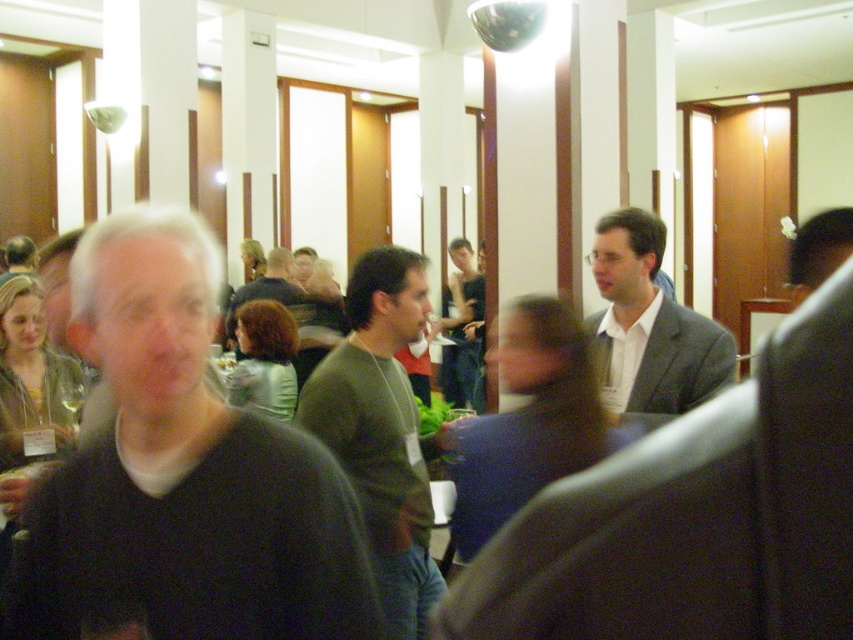
Question: Estimate the real-world distances between objects in this image. Which object is closer to the dark gray sweater at center?

Choices:
 (A) green matte sweater at center
 (B) white shirt at center
 (C) light gray suit at center
 (D) green matte shirt at center

Answer: (B)

Question: Does white shirt at center lie behind green matte shirt at center?

Choices:
 (A) no
 (B) yes

Answer: (A)

Question: In this image, where is dark gray sweater at center located relative to green matte shirt at center?

Choices:
 (A) above
 (B) below

Answer: (B)

Question: Can you confirm if dark gray sweater at center is positioned to the left of green matte sweater at center?

Choices:
 (A) yes
 (B) no

Answer: (A)

Question: Estimate the real-world distances between objects in this image. Which object is closer to the green matte sweater at center?

Choices:
 (A) light gray suit at center
 (B) dark gray sweater at center
 (C) white shirt at center
 (D) green matte shirt at center

Answer: (C)

Question: Among these points, which one is nearest to the camera?

Choices:
 (A) (70, 556)
 (B) (463, 392)

Answer: (A)